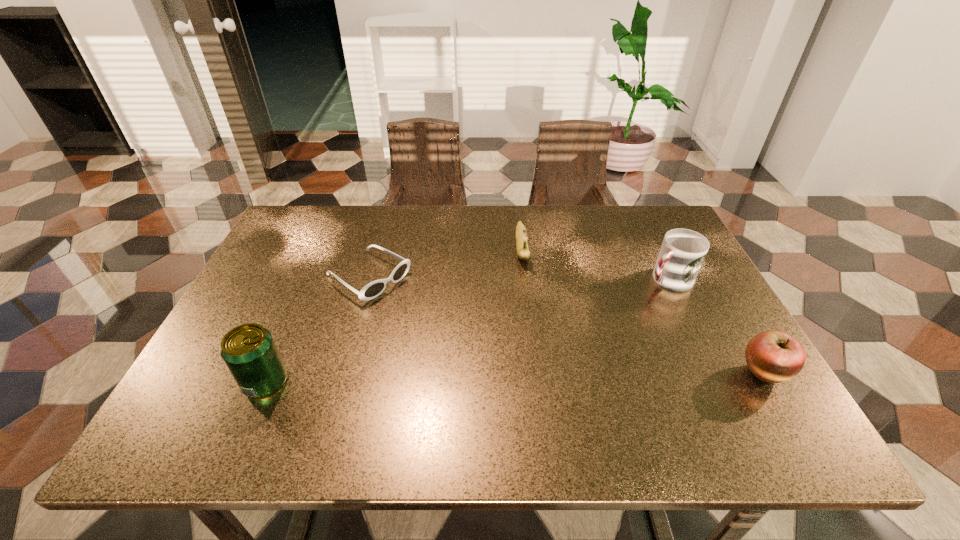
Where is `vacant space on the desktop that is between the beer can and the apple and is positioned at the stem of the third object from right to left`? This screenshot has width=960, height=540. vacant space on the desktop that is between the beer can and the apple and is positioned at the stem of the third object from right to left is located at coordinates (536, 378).

Identify the location of vacant space on the desktop that is between the beer can and the apple and is positioned with the lenses of the shortest object facing outward. The width and height of the screenshot is (960, 540). (530, 378).

In order to click on free spot on the desktop that is between the beer can and the apple and is positioned on the side of the cup where the handle is located in this screenshot , I will do `click(514, 378)`.